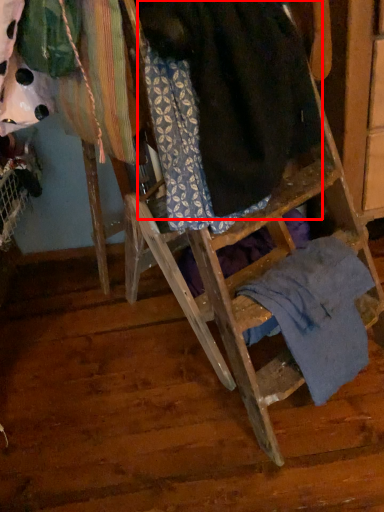
Question: From the image's perspective, considering the relative positions of wool (annotated by the red box) and underclothes in the image provided, where is wool (annotated by the red box) located with respect to the staircase?

Choices:
 (A) above
 (B) below

Answer: (A)